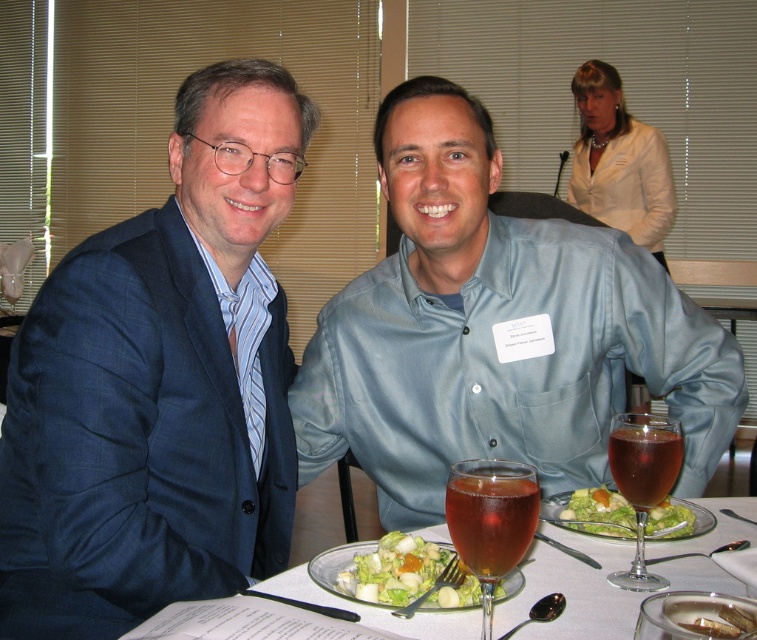
Does light blue shirt at center have a lesser width compared to translucent amber liquid at center?

No.

In order to click on light blue shirt at center in this screenshot , I will do `click(497, 332)`.

Between translucent glass wine at center and green leafy salad at center, which one is positioned lower?

green leafy salad at center is lower down.

Who is more forward, (528, 513) or (612, 525)?

Point (528, 513) is in front.

This screenshot has height=640, width=757. Find the location of `translucent glass wine at center`. translucent glass wine at center is located at coordinates (491, 518).

The image size is (757, 640). What do you see at coordinates (497, 332) in the screenshot?
I see `light blue shirt at center` at bounding box center [497, 332].

Does light blue shirt at center have a lesser width compared to fresh green salad at center?

Incorrect, light blue shirt at center's width is not less than fresh green salad at center's.

The image size is (757, 640). What are the coordinates of `light blue shirt at center` in the screenshot? It's located at (x=497, y=332).